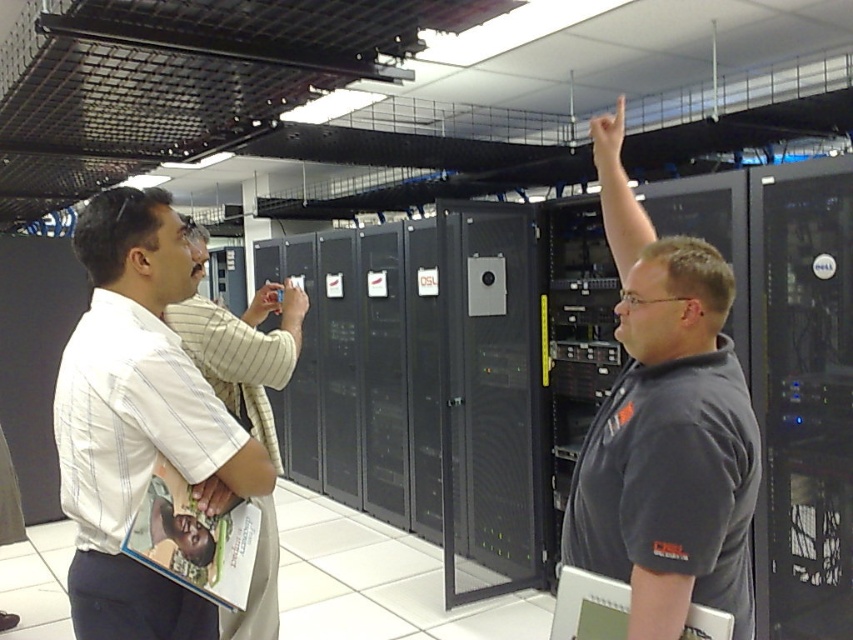
What do you see at coordinates (244, 353) in the screenshot? I see `white striped shirt at center` at bounding box center [244, 353].

Is white striped shirt at center bigger than matte gray laptop at center?

Correct, white striped shirt at center is larger in size than matte gray laptop at center.

You are a GUI agent. You are given a task and a screenshot of the screen. Output one action in this format:
    pyautogui.click(x=<x>, y=<y>)
    Task: Click on the white striped shirt at center
    
    Given the screenshot: What is the action you would take?
    pyautogui.click(x=244, y=353)

Does point (676, 625) lie behind point (206, 333)?

That is False.

Measure the distance from dark gray shirt at center to white striped shirt at center.

3.38 feet

Which is in front, point (646, 564) or point (250, 365)?

Point (646, 564) is more forward.

Locate an element on the screen. The width and height of the screenshot is (853, 640). dark gray shirt at center is located at coordinates (666, 428).

Who is positioned more to the left, white striped shirt at left or matte gray laptop at center?

white striped shirt at left

Does point (135, 211) come in front of point (601, 618)?

No.

The width and height of the screenshot is (853, 640). Describe the element at coordinates (138, 419) in the screenshot. I see `white striped shirt at left` at that location.

At what (x,y) coordinates should I click in order to perform the action: click on white striped shirt at left. Please return your answer as a coordinate pair (x, y). The height and width of the screenshot is (640, 853). Looking at the image, I should click on (138, 419).